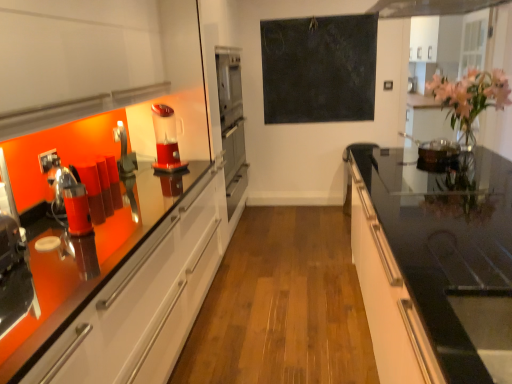
Question: In the image, is matte black coffee machine at left, arranged as the 2th coffee machine when viewed from the right, on the left side or the right side of dark matte chalkboard at center?

Choices:
 (A) left
 (B) right

Answer: (A)

Question: From the image's perspective, relative to dark matte chalkboard at center, is matte black coffee machine at left, the 1th coffee machine when ordered from bottom to top, above or below?

Choices:
 (A) below
 (B) above

Answer: (A)

Question: Based on their relative distances, which object is nearer to the red plastic blender at center, acting as the first coffee machine starting from the top?

Choices:
 (A) pink glossy vase at upper right
 (B) metallic silver blender at left
 (C) matte black coffee machine at left, the 1th coffee machine in the left-to-right sequence
 (D) black glass countertop at right
 (E) satin silver oven at center

Answer: (B)

Question: Which object is the farthest from the dark matte chalkboard at center?

Choices:
 (A) pink glossy vase at upper right
 (B) metallic silver blender at left
 (C) satin silver oven at center
 (D) black glass countertop at right
 (E) red plastic blender at center, acting as the first coffee machine starting from the top

Answer: (B)